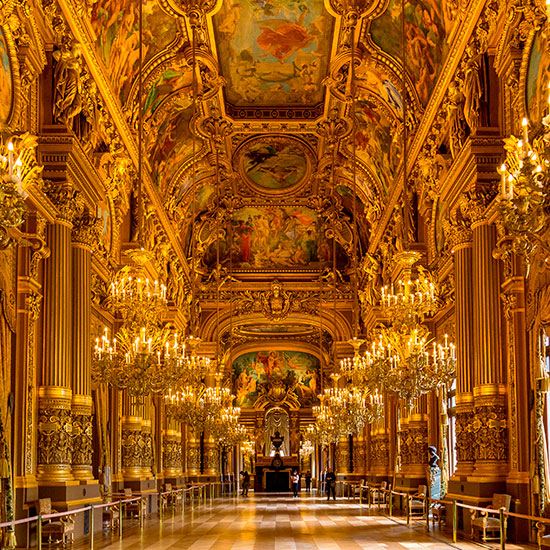
Locate an element on the screen. This screenshot has height=550, width=550. gold trim is located at coordinates (341, 320), (211, 322), (79, 182), (459, 185), (414, 145), (165, 217).